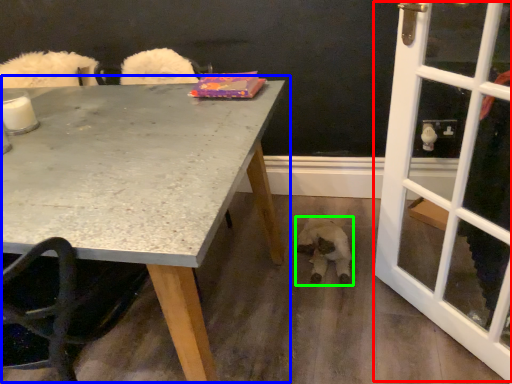
Question: Estimate the real-world distances between objects in this image. Which object is farther from screen door (highlighted by a red box), table (highlighted by a blue box) or animal (highlighted by a green box)?

Choices:
 (A) table
 (B) animal

Answer: (A)